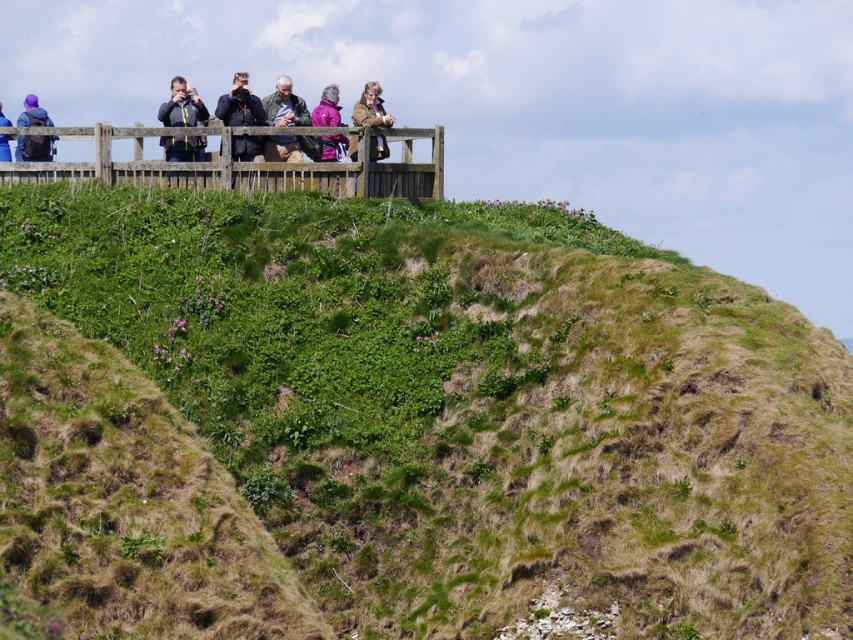
Question: Does green grassy hillside at upper center lie behind pink fabric jacket at upper center?

Choices:
 (A) no
 (B) yes

Answer: (A)

Question: Based on their relative distances, which object is farther from the matte gray jacket at center?

Choices:
 (A) dark blue jacket at upper center
 (B) green grassy hillside at lower left
 (C) wooden fence at upper center
 (D) matte blue jacket at upper left

Answer: (B)

Question: Which of the following is the farthest from the observer?

Choices:
 (A) matte blue jacket at upper left
 (B) brown leather jacket at upper center

Answer: (A)

Question: Which object is closer to the camera taking this photo?

Choices:
 (A) matte purple backpack at upper left
 (B) green grassy hillside at lower left

Answer: (B)

Question: Can you confirm if green grassy hillside at lower left is positioned below dark blue jacket at upper center?

Choices:
 (A) yes
 (B) no

Answer: (A)

Question: Is brown leather jacket at upper center to the left of matte purple backpack at upper left from the viewer's perspective?

Choices:
 (A) yes
 (B) no

Answer: (B)